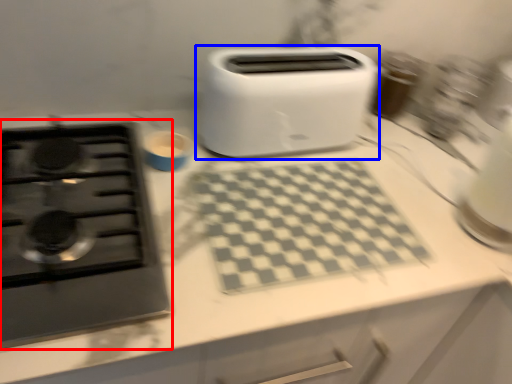
Question: Which point is closer to the camera, gas stove (highlighted by a red box) or toaster (highlighted by a blue box)?

Choices:
 (A) gas stove
 (B) toaster

Answer: (A)